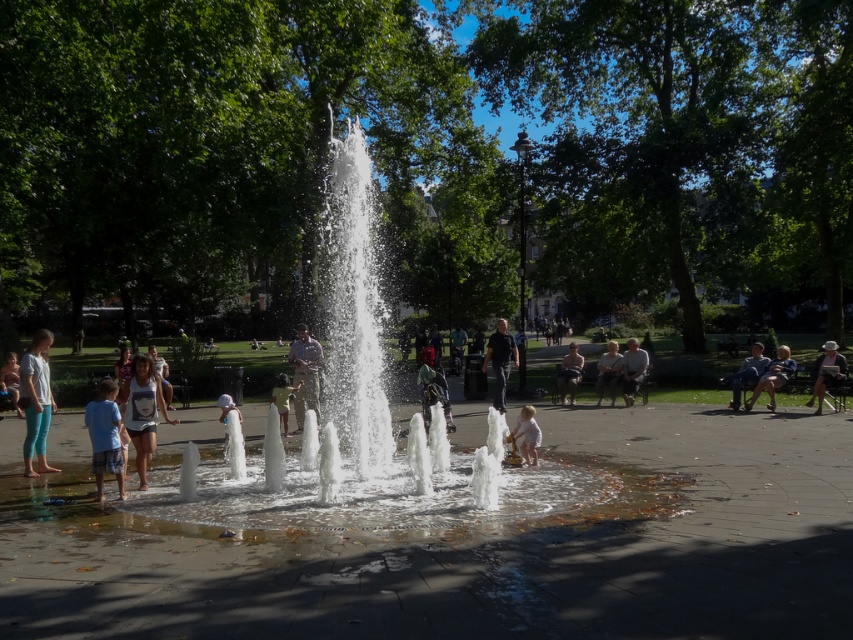
Question: Which object is closer to the camera taking this photo?

Choices:
 (A) white fabric hat at right
 (B) blue cotton shirt at lower left
 (C) light brown wooden bench at lower left
 (D) white tank top at center

Answer: (B)

Question: Estimate the real-world distances between objects in this image. Which object is closer to the light brown wooden bench at right?

Choices:
 (A) light brown leather jacket at center
 (B) light brown fabric shorts at center
 (C) gray fabric jacket at lower right
 (D) denim jacket at right

Answer: (D)

Question: Which of these objects is positioned closest to the black matte shirt at center?

Choices:
 (A) white fabric hat at right
 (B) clear water at center

Answer: (B)

Question: Where is green fabric jacket at center located in relation to light brown wooden bench at center right in the image?

Choices:
 (A) below
 (B) above

Answer: (A)

Question: Does light blue leggings at left appear on the left side of light brown leather jacket at center?

Choices:
 (A) no
 (B) yes

Answer: (B)

Question: Is white tank top at center thinner than black matte shirt at center?

Choices:
 (A) no
 (B) yes

Answer: (B)